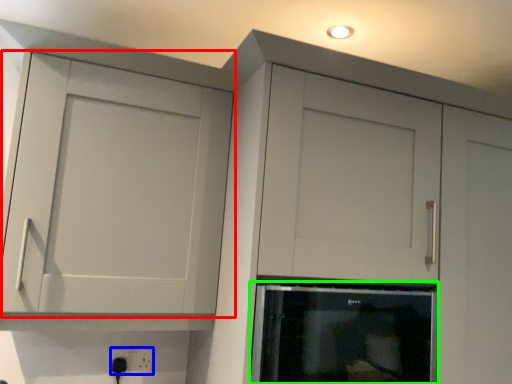
Question: Which is nearer to the cupboard (highlighted by a red box)? electric outlet (highlighted by a blue box) or appliance (highlighted by a green box).

Choices:
 (A) electric outlet
 (B) appliance

Answer: (B)